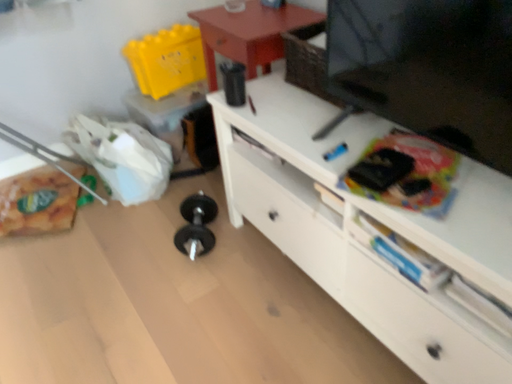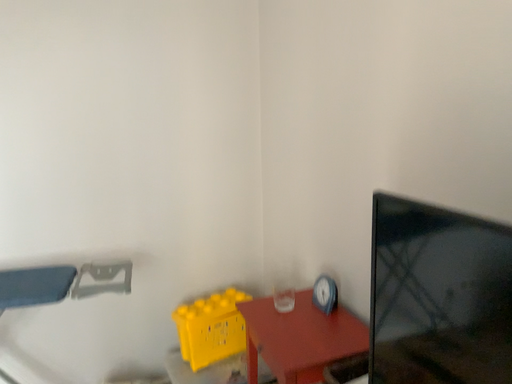
Question: How did the camera likely rotate when shooting the video?

Choices:
 (A) rotated downward
 (B) rotated upward

Answer: (B)